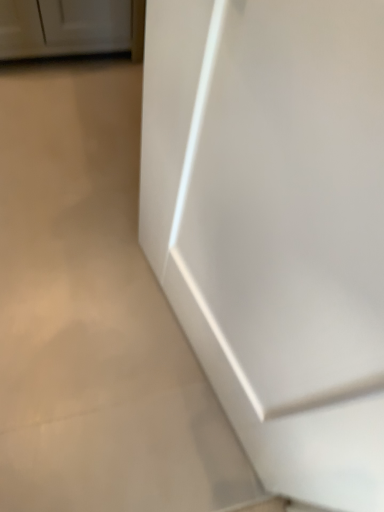
Image resolution: width=384 pixels, height=512 pixels. What do you see at coordinates (95, 316) in the screenshot?
I see `white smooth concrete at lower right` at bounding box center [95, 316].

Locate an element on the screen. The image size is (384, 512). white smooth concrete at lower right is located at coordinates (95, 316).

Where is `white smooth concrete at lower right`? white smooth concrete at lower right is located at coordinates (95, 316).